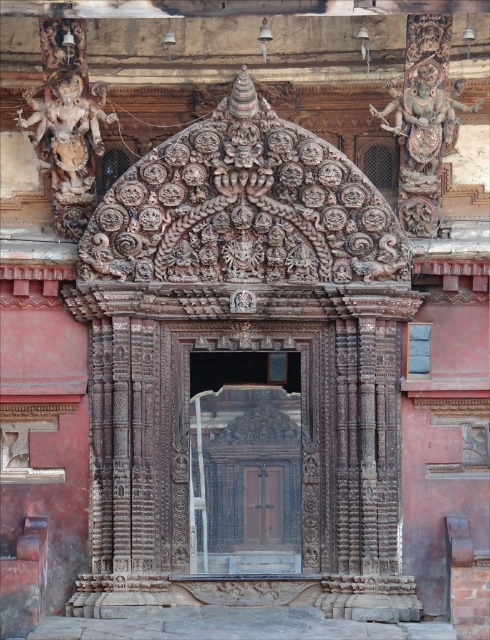
Where is `dark wood door at center`? The height and width of the screenshot is (640, 490). dark wood door at center is located at coordinates (244, 465).

Who is more forward, (196, 566) or (84, 189)?

Point (196, 566) is in front.

I want to click on dark wood door at center, so click(x=244, y=465).

Which is more to the right, dark wood door at center or carved wood deity at center?

carved wood deity at center is more to the right.

What do you see at coordinates (244, 465) in the screenshot? Image resolution: width=490 pixels, height=640 pixels. I see `dark wood door at center` at bounding box center [244, 465].

Where is `dark wood door at center`? This screenshot has width=490, height=640. dark wood door at center is located at coordinates (244, 465).

Does point (435, 193) lie in front of point (86, 189)?

No, (435, 193) is behind (86, 189).

Between carved wood deity at center and carved stone statue at upper left, which one appears on the left side from the viewer's perspective?

Positioned to the left is carved stone statue at upper left.

Identify the location of carved wood deity at center. This screenshot has height=640, width=490. click(x=422, y=138).